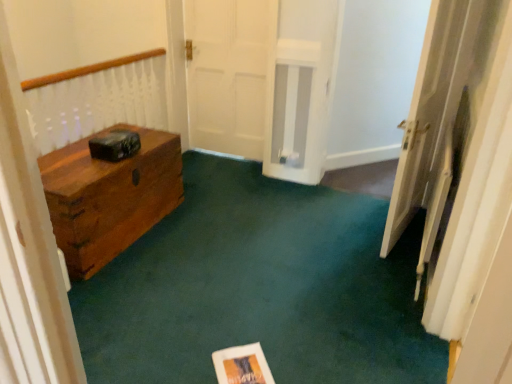
Question: Considering the positions of white wooden door at right and matte paper at center in the image, is white wooden door at right bigger or smaller than matte paper at center?

Choices:
 (A) big
 (B) small

Answer: (A)

Question: Is white wooden door at right situated inside matte paper at center or outside?

Choices:
 (A) outside
 (B) inside

Answer: (A)

Question: Considering the positions of point (458, 1) and point (242, 364), is point (458, 1) closer or farther from the camera than point (242, 364)?

Choices:
 (A) closer
 (B) farther

Answer: (B)

Question: Considering the positions of matte paper at center and white wooden door at right in the image, is matte paper at center bigger or smaller than white wooden door at right?

Choices:
 (A) big
 (B) small

Answer: (B)

Question: In terms of height, does matte paper at center look taller or shorter compared to white wooden door at right?

Choices:
 (A) short
 (B) tall

Answer: (A)

Question: Relative to white wooden door at right, is matte paper at center in front or behind?

Choices:
 (A) behind
 (B) front

Answer: (B)

Question: Is matte paper at center inside the boundaries of white wooden door at right, or outside?

Choices:
 (A) outside
 (B) inside

Answer: (A)